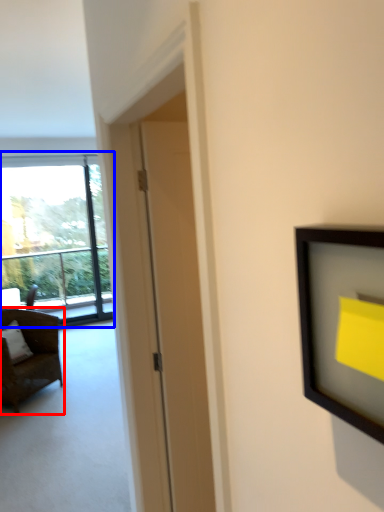
Question: Which object is further to the camera taking this photo, chair (highlighted by a red box) or window (highlighted by a blue box)?

Choices:
 (A) chair
 (B) window

Answer: (B)